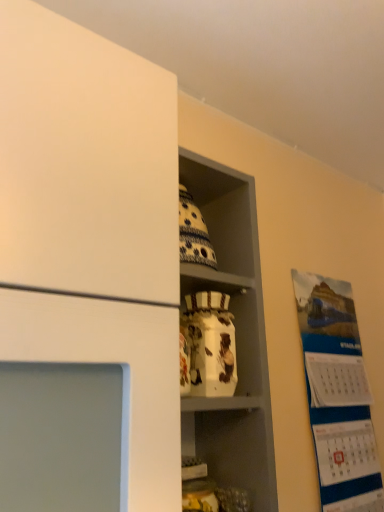
Question: Is point (221, 282) positioned closer to the camera than point (359, 438)?

Choices:
 (A) farther
 (B) closer

Answer: (B)

Question: From the image's perspective, is white glossy jar at center located above or below white paper calendar at right?

Choices:
 (A) below
 (B) above

Answer: (B)

Question: Which object is the farthest from the white glossy vase at center?

Choices:
 (A) white glossy jar at center
 (B) white paper calendar at right

Answer: (B)

Question: Which is nearer to the white glossy vase at center?

Choices:
 (A) white glossy jar at center
 (B) white paper calendar at right

Answer: (A)